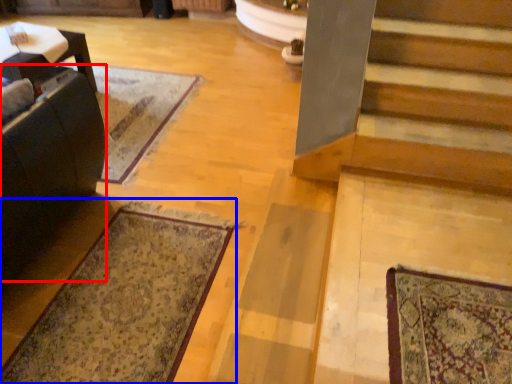
Question: Among these objects, which one is nearest to the camera, rocking chair (highlighted by a red box) or mat (highlighted by a blue box)?

Choices:
 (A) rocking chair
 (B) mat

Answer: (A)